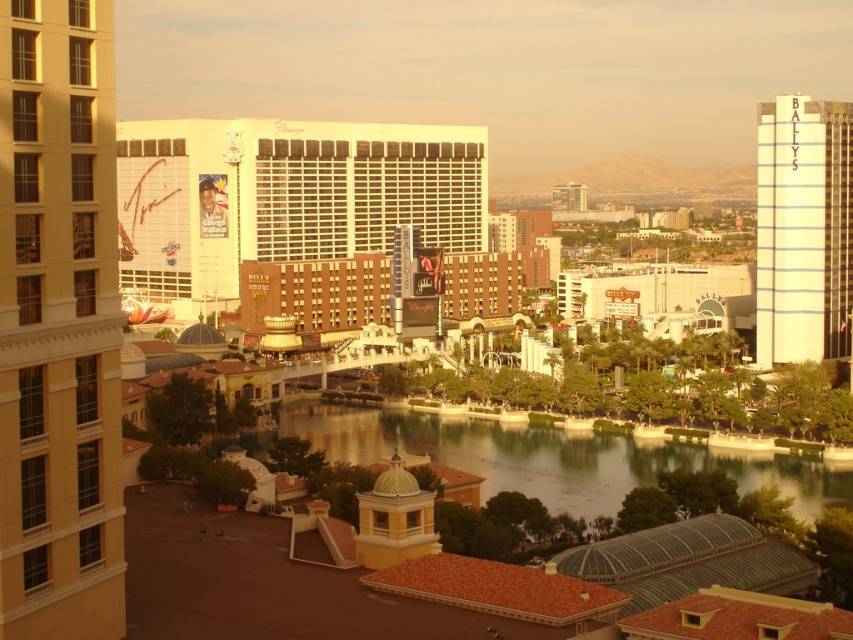
You are standing at the edge of the water in the foreground of the urban scene. There is a specific point marked at coordinates point (544, 444). Can you estimate how far this point is from your current position?

The point (544, 444) is 674.59 feet away from your current position.

You are planning to install a floating walkway that connects the greenish water at center to the matte glass building at center. The walkway requires a minimum clearance of 1200 feet between the two points. Based on the scene, will the walkway fit?

The greenish water at center and matte glass building at center are 1223.73 feet apart, which exceeds the required 1200 feet clearance. Therefore, the walkway can be installed between them.